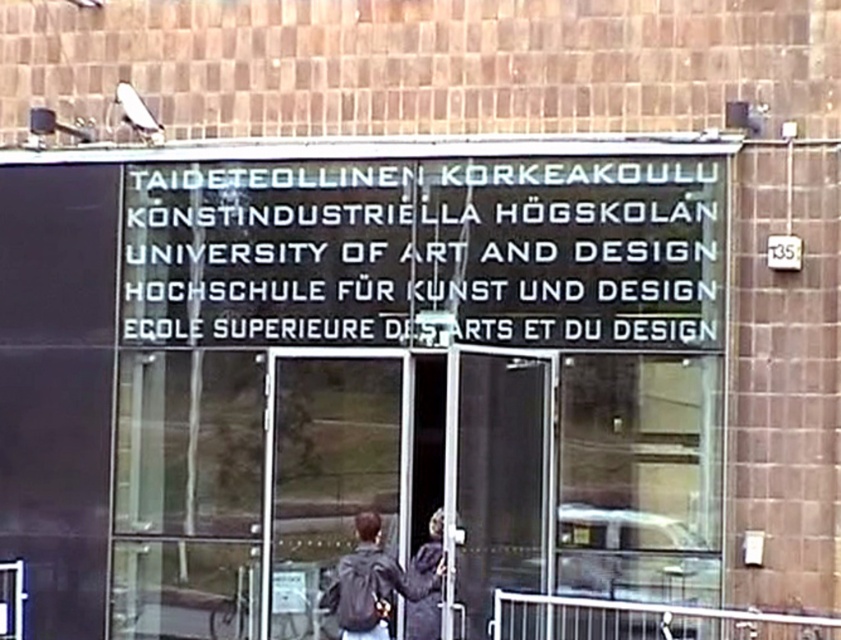
Which of these two, black glass sign at center or dark gray jacket at center, stands taller?

dark gray jacket at center

The height and width of the screenshot is (640, 841). What do you see at coordinates (357, 372) in the screenshot?
I see `black glass sign at center` at bounding box center [357, 372].

Is point (156, 460) more distant than point (438, 516)?

Yes, point (156, 460) is farther from viewer.

This screenshot has height=640, width=841. Find the location of `black glass sign at center`. black glass sign at center is located at coordinates (357, 372).

Can you confirm if white plastic sign at center is thinner than matte black jacket at center?

Indeed, white plastic sign at center has a lesser width compared to matte black jacket at center.

Can you confirm if white plastic sign at center is positioned above matte black jacket at center?

Correct, white plastic sign at center is located above matte black jacket at center.

What are the coordinates of `white plastic sign at center` in the screenshot? It's located at (426, 252).

The width and height of the screenshot is (841, 640). Find the location of `black glass sign at center`. black glass sign at center is located at coordinates (357, 372).

Locate an element on the screen. The image size is (841, 640). black glass sign at center is located at coordinates (357, 372).